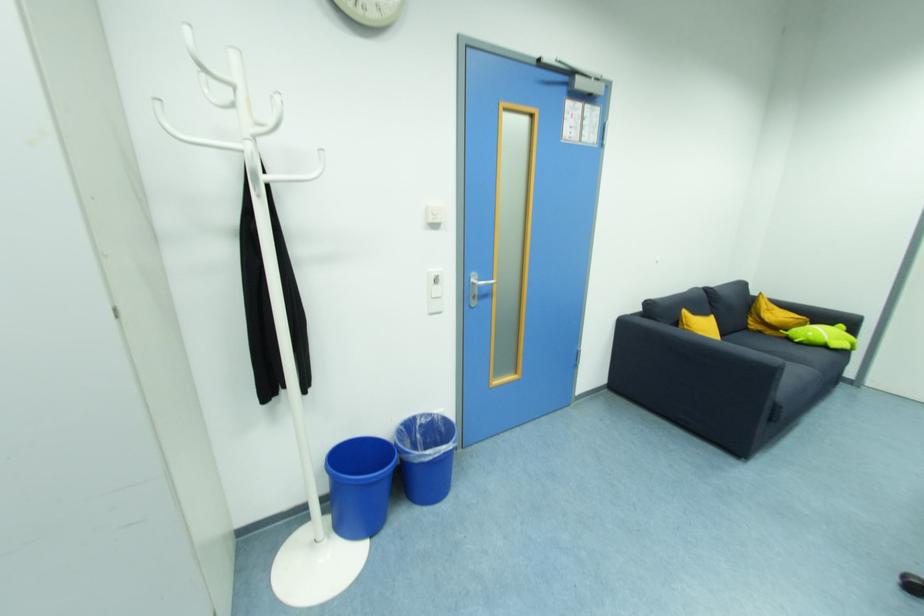
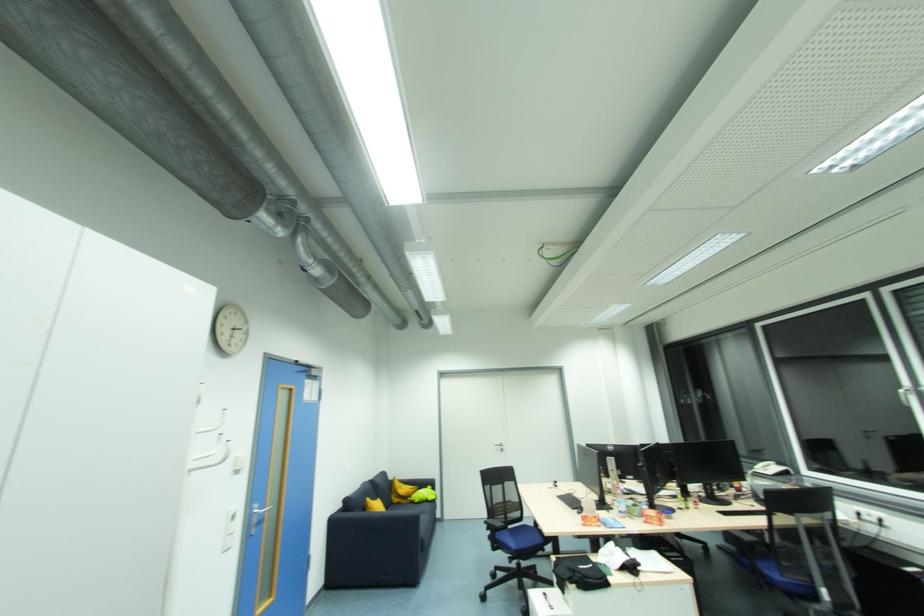
Where in the second image is the point corresponding to (762,334) from the first image?

(400, 505)